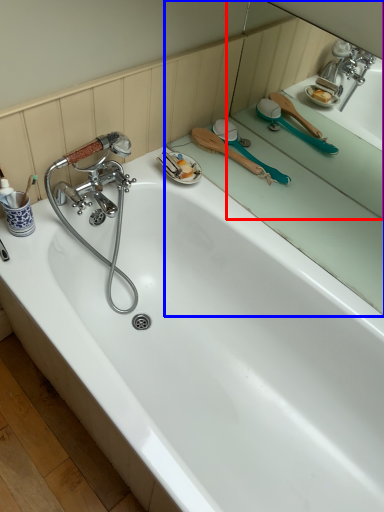
Question: Among these objects, which one is nearest to the camera, mirror (highlighted by a red box) or mirror (highlighted by a blue box)?

Choices:
 (A) mirror
 (B) mirror

Answer: (A)